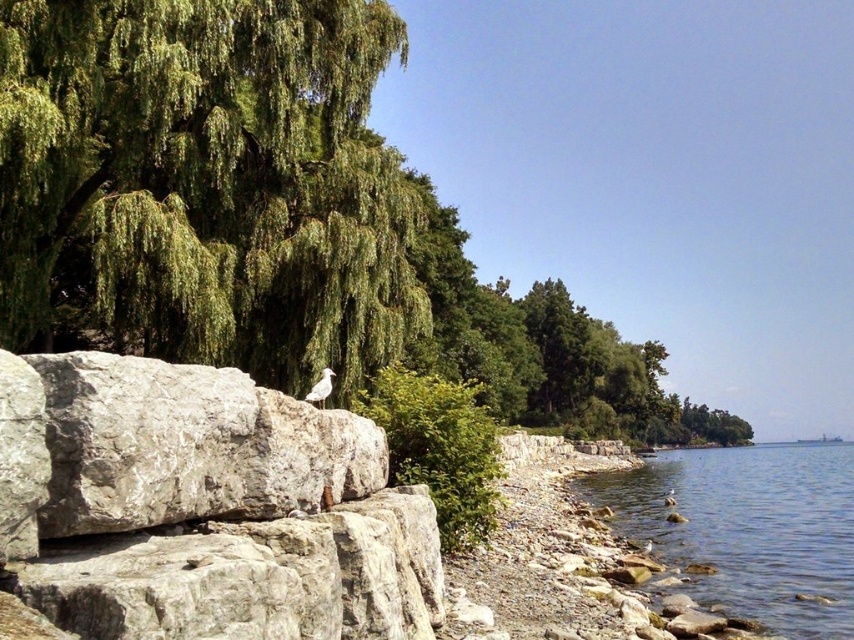
Question: Considering the real-world distances, which object is farthest from the green leafy tree at upper left?

Choices:
 (A) white matte bird at lower right
 (B) gray rough rock at center
 (C) clear water at shore right

Answer: (A)

Question: Estimate the real-world distances between objects in this image. Which object is farther from the white matte bird at lower right?

Choices:
 (A) green leafy tree at center
 (B) clear water at shore right

Answer: (A)

Question: Does clear water at shore right appear on the right side of green leafy tree at center?

Choices:
 (A) no
 (B) yes

Answer: (B)

Question: Which object is the closest to the green leafy tree at upper left?

Choices:
 (A) white matte bird at lower right
 (B) gray rough rock at center
 (C) green leafy tree at center

Answer: (B)

Question: Is green leafy tree at center further to camera compared to white matte bird at lower right?

Choices:
 (A) yes
 (B) no

Answer: (B)

Question: Can you confirm if green leafy tree at center is wider than white matte bird at lower right?

Choices:
 (A) yes
 (B) no

Answer: (A)